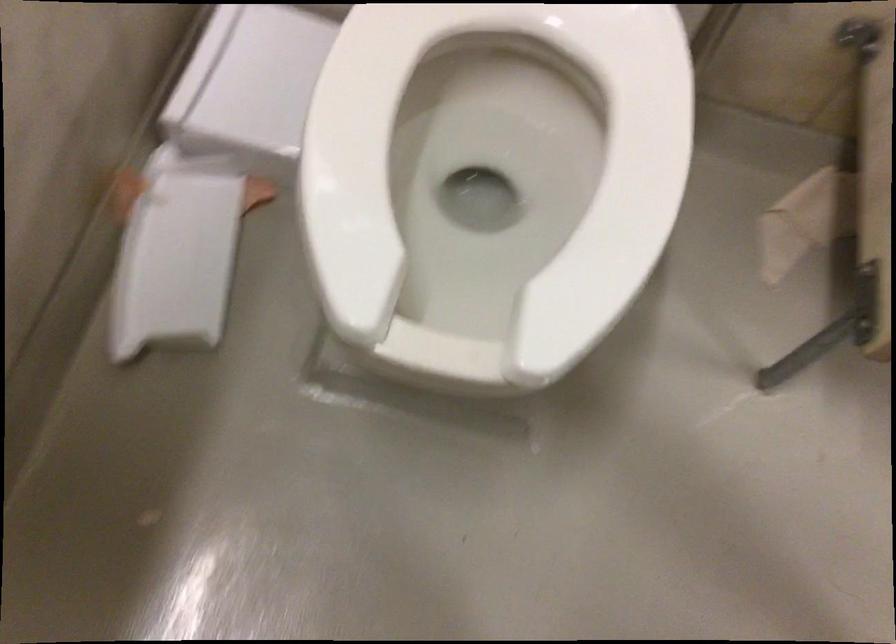
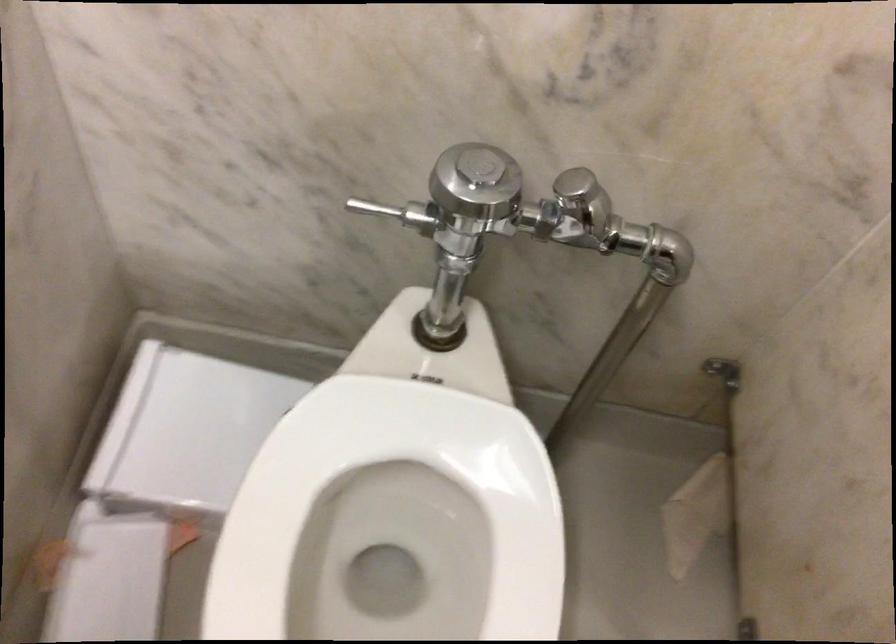
Question: Based on the continuous images, in which direction is the camera rotating? Reply with the corresponding letter.

Choices:
 (A) Left
 (B) Right
 (C) Up
 (D) Down

Answer: (C)